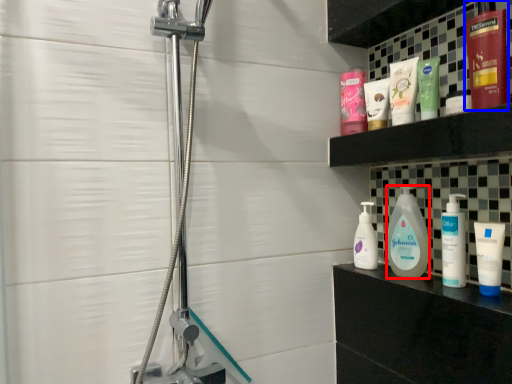
Question: Which point is closer to the camera, cleaning product (highlighted by a red box) or toiletry (highlighted by a blue box)?

Choices:
 (A) cleaning product
 (B) toiletry

Answer: (B)